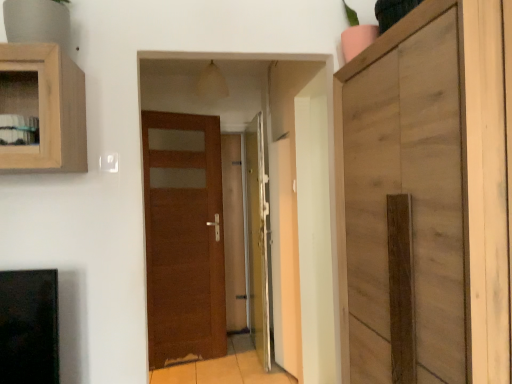
Question: From the image's perspective, is transparent glass door at center under brown wood door at center, the first door when ordered from left to right?

Choices:
 (A) yes
 (B) no

Answer: (B)

Question: Is transparent glass door at center oriented away from brown wood door at center, the first door when ordered from left to right?

Choices:
 (A) no
 (B) yes

Answer: (A)

Question: Does transparent glass door at center have a lesser height compared to brown wood door at center, arranged as the second door when viewed from the right?

Choices:
 (A) no
 (B) yes

Answer: (A)

Question: Can brown wood door at center, the first door when ordered from left to right, be found inside transparent glass door at center?

Choices:
 (A) yes
 (B) no

Answer: (B)

Question: Is transparent glass door at center at the left side of brown wood door at center, the first door when ordered from left to right?

Choices:
 (A) yes
 (B) no

Answer: (B)

Question: Considering the positions of transparent glass door at center and translucent glass door at center, which is the second door in left-to-right order, in the image, is transparent glass door at center wider or thinner than translucent glass door at center, which is the second door in left-to-right order,?

Choices:
 (A) wide
 (B) thin

Answer: (A)

Question: Looking at the image, does transparent glass door at center seem bigger or smaller compared to translucent glass door at center, the first door from the right?

Choices:
 (A) small
 (B) big

Answer: (B)

Question: Considering their positions, is transparent glass door at center located in front of or behind translucent glass door at center, the first door from the right?

Choices:
 (A) behind
 (B) front

Answer: (A)

Question: From their relative heights in the image, would you say transparent glass door at center is taller or shorter than translucent glass door at center, which is the second door in left-to-right order?

Choices:
 (A) short
 (B) tall

Answer: (B)

Question: Considering the relative positions of translucent glass door at center, the first door from the right, and transparent glass door at center in the image provided, is translucent glass door at center, the first door from the right, to the left or to the right of transparent glass door at center?

Choices:
 (A) right
 (B) left

Answer: (A)

Question: In terms of width, does translucent glass door at center, which is the second door in left-to-right order, look wider or thinner when compared to transparent glass door at center?

Choices:
 (A) wide
 (B) thin

Answer: (B)

Question: Considering the positions of translucent glass door at center, the first door from the right, and transparent glass door at center in the image, is translucent glass door at center, the first door from the right, taller or shorter than transparent glass door at center?

Choices:
 (A) tall
 (B) short

Answer: (B)

Question: Is translucent glass door at center, the first door from the right, in front of or behind transparent glass door at center in the image?

Choices:
 (A) front
 (B) behind

Answer: (A)

Question: Is transparent glass door at center inside the boundaries of wooden cabinet at right, or outside?

Choices:
 (A) inside
 (B) outside

Answer: (B)

Question: In terms of width, does transparent glass door at center look wider or thinner when compared to wooden cabinet at right?

Choices:
 (A) wide
 (B) thin

Answer: (B)